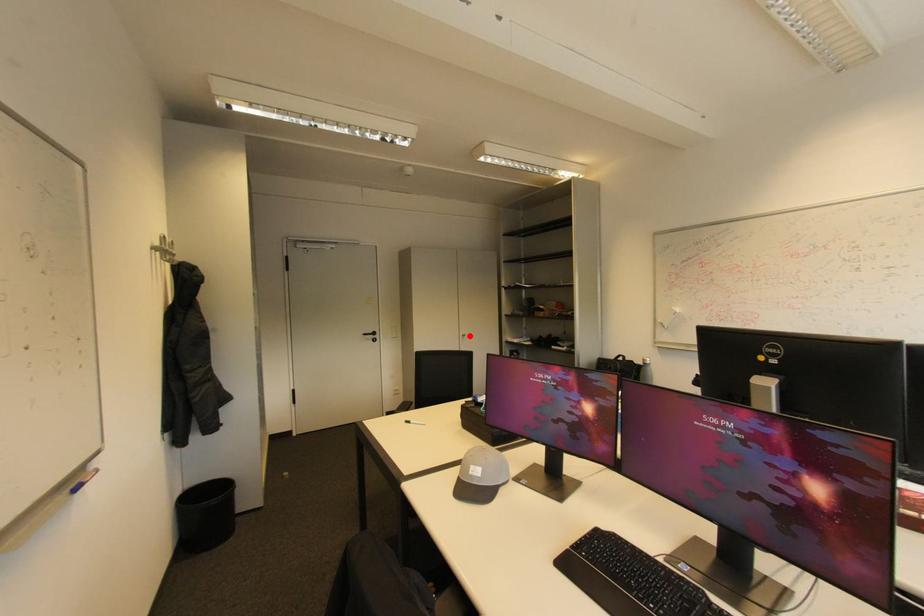
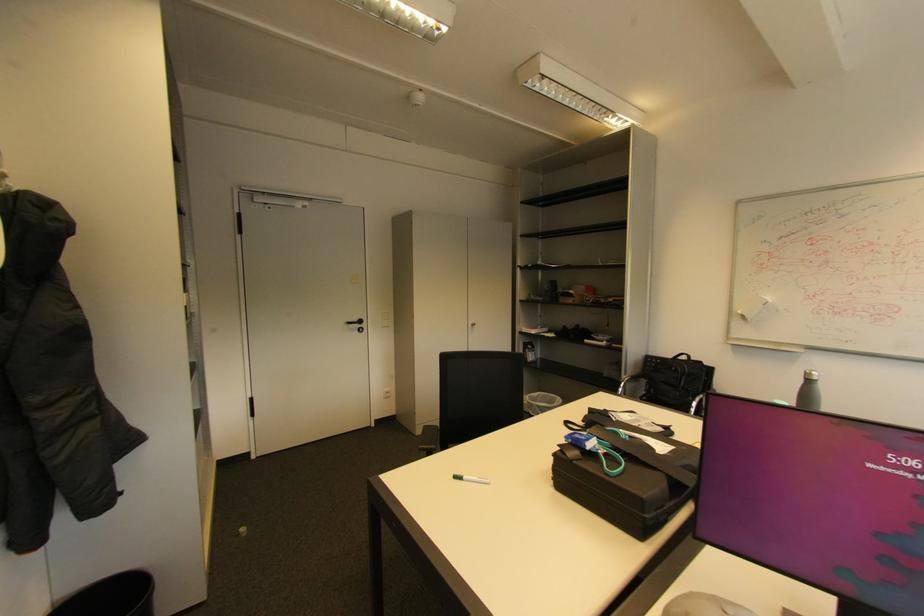
Where in the second image is the point corresponding to the highlighted location from the first image?

(479, 326)